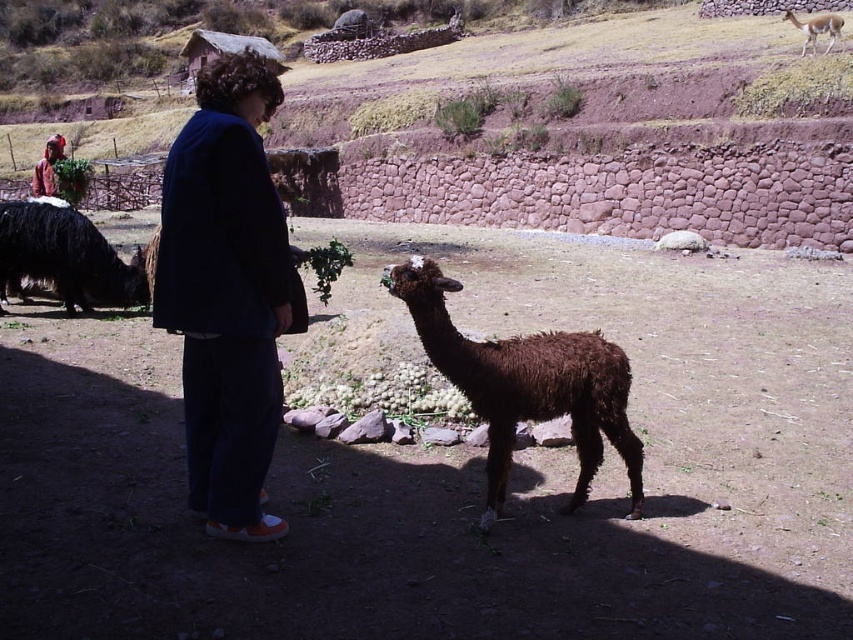
Does dark blue fabric at center appear under brown woolly alpaca at center?

No.

Which is above, dark blue fabric at center or brown woolly alpaca at center?

dark blue fabric at center is above.

What do you see at coordinates (225, 292) in the screenshot? I see `dark blue fabric at center` at bounding box center [225, 292].

Find the location of a particular element. Image resolution: width=853 pixels, height=640 pixels. dark blue fabric at center is located at coordinates (225, 292).

Does dark blue fabric at center have a lesser width compared to black woolen llama at left?

Yes.

Measure the distance between dark blue fabric at center and black woolen llama at left.

dark blue fabric at center and black woolen llama at left are 6.68 meters apart.

Does point (219, 83) come behind point (16, 259)?

No, (219, 83) is closer to viewer.

Identify the location of dark blue fabric at center. This screenshot has width=853, height=640. (x=225, y=292).

Can you confirm if dark blue fabric at center is wider than light brown fur camel at upper right?

No, dark blue fabric at center is not wider than light brown fur camel at upper right.

Can you confirm if dark blue fabric at center is positioned above light brown fur camel at upper right?

No, dark blue fabric at center is not above light brown fur camel at upper right.

Measure the distance between point (273, 237) and camera.

Point (273, 237) and camera are 12.16 feet apart from each other.

This screenshot has width=853, height=640. Find the location of `dark blue fabric at center`. dark blue fabric at center is located at coordinates (225, 292).